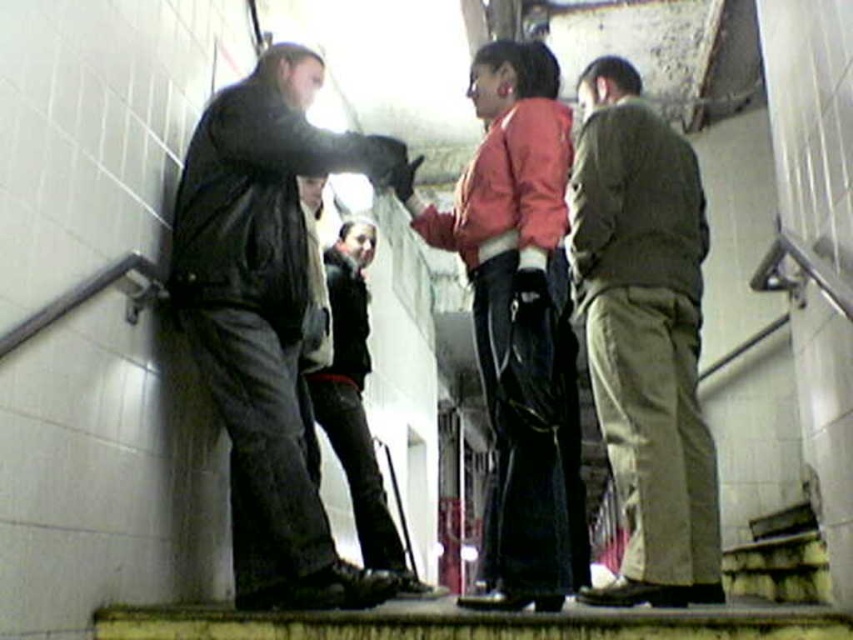
Question: Can you confirm if dark green fabric pants at right is positioned above matte pink jacket at center?

Choices:
 (A) yes
 (B) no

Answer: (B)

Question: From the image, what is the correct spatial relationship of dark green fabric pants at right in relation to leather jacket at center?

Choices:
 (A) above
 (B) below

Answer: (A)

Question: Does matte black jacket at left appear on the right side of leather jacket at center?

Choices:
 (A) no
 (B) yes

Answer: (A)

Question: Considering the real-world distances, which object is closest to the dark green fabric pants at right?

Choices:
 (A) matte pink jacket at center
 (B) leather jacket at center

Answer: (A)

Question: Which of these objects is positioned closest to the dark green fabric pants at right?

Choices:
 (A) leather jacket at center
 (B) matte pink jacket at center

Answer: (B)

Question: Which point is closer to the camera?

Choices:
 (A) (351, 156)
 (B) (695, 496)

Answer: (A)